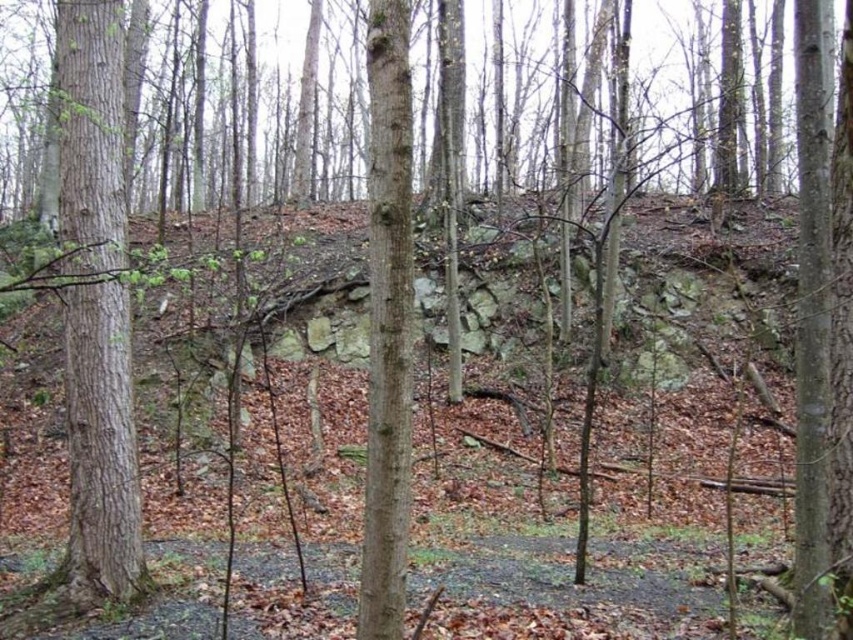
Question: Does smooth brown tree trunk at left have a greater width compared to smooth brown tree trunk at center?

Choices:
 (A) yes
 (B) no

Answer: (A)

Question: Does smooth brown tree trunk at left appear over smooth brown tree trunk at center?

Choices:
 (A) no
 (B) yes

Answer: (B)

Question: Which object is closer to the camera taking this photo?

Choices:
 (A) smooth brown tree trunk at center
 (B) smooth brown tree trunk at left

Answer: (A)

Question: Which of the following is the farthest from the observer?

Choices:
 (A) smooth brown tree trunk at left
 (B) smooth brown tree trunk at center

Answer: (A)

Question: Is smooth brown tree trunk at left bigger than smooth brown tree trunk at center?

Choices:
 (A) no
 (B) yes

Answer: (B)